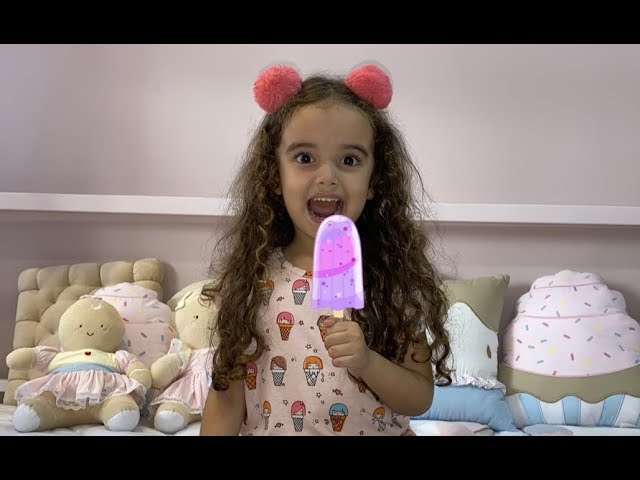
The height and width of the screenshot is (480, 640). In order to click on pillow in this screenshot , I will do `click(59, 292)`, `click(493, 315)`.